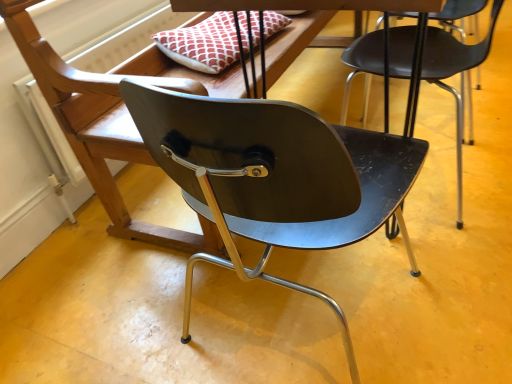
In order to face matte black chair at center, the 1th chair viewed from the left, should I rotate leftwards or rightwards?

Rotate right and turn 4.999 degrees.

The width and height of the screenshot is (512, 384). I want to click on matte black chair at center, which is the second chair in right-to-left order, so click(97, 132).

The height and width of the screenshot is (384, 512). What do you see at coordinates (97, 132) in the screenshot?
I see `matte black chair at center, the 1th chair viewed from the left` at bounding box center [97, 132].

What do you see at coordinates (454, 74) in the screenshot? I see `matte black chair at center, which ranks as the first chair in right-to-left order` at bounding box center [454, 74].

Where is `matte black chair at center, acting as the second chair starting from the left`? The height and width of the screenshot is (384, 512). matte black chair at center, acting as the second chair starting from the left is located at coordinates pyautogui.click(x=454, y=74).

What is the approximate height of matte black chair at center, acting as the second chair starting from the left?

It is 24.71 inches.

Find the location of a particular element. matte black chair at center, which is the second chair in right-to-left order is located at coordinates click(x=97, y=132).

Which object is positioned more to the right, matte black chair at center, which is the second chair in right-to-left order, or matte black chair at center, acting as the second chair starting from the left?

matte black chair at center, acting as the second chair starting from the left.

Does matte black chair at center, the 1th chair viewed from the left, lie behind matte black chair at center, acting as the second chair starting from the left?

That is False.

Is point (77, 154) in front of point (350, 79)?

Yes.

From the image's perspective, is matte black chair at center, the 1th chair viewed from the left, above matte black chair at center, which ranks as the first chair in right-to-left order?

No.

From a real-world perspective, is matte black chair at center, which is the second chair in right-to-left order, over matte black chair at center, acting as the second chair starting from the left?

Indeed, from a real-world perspective, matte black chair at center, which is the second chair in right-to-left order, stands above matte black chair at center, acting as the second chair starting from the left.

Which of these two, matte black chair at center, which is the second chair in right-to-left order, or matte black chair at center, acting as the second chair starting from the left, is thinner?

matte black chair at center, acting as the second chair starting from the left.

Can you confirm if matte black chair at center, the 1th chair viewed from the left, is taller than matte black chair at center, acting as the second chair starting from the left?

Yes, matte black chair at center, the 1th chair viewed from the left, is taller than matte black chair at center, acting as the second chair starting from the left.

Consider the image. Considering the relative sizes of matte black chair at center, which is the second chair in right-to-left order, and matte black chair at center, which ranks as the first chair in right-to-left order, in the image provided, is matte black chair at center, which is the second chair in right-to-left order, bigger than matte black chair at center, which ranks as the first chair in right-to-left order,?

Yes.

Which is correct: matte black chair at center, which is the second chair in right-to-left order, is inside matte black chair at center, which ranks as the first chair in right-to-left order, or outside of it?

matte black chair at center, which is the second chair in right-to-left order, lies outside matte black chair at center, which ranks as the first chair in right-to-left order.

Are matte black chair at center, which is the second chair in right-to-left order, and matte black chair at center, which ranks as the first chair in right-to-left order, located far from each other?

No, matte black chair at center, which is the second chair in right-to-left order, is not far away from matte black chair at center, which ranks as the first chair in right-to-left order.

Is matte black chair at center, the 1th chair viewed from the left, oriented towards matte black chair at center, acting as the second chair starting from the left?

Yes.

In order to click on chair below the matte black chair at center, the 1th chair viewed from the left (from a real-world perspective) in this screenshot , I will do `click(454, 74)`.

Does matte black chair at center, acting as the second chair starting from the left, appear on the left side of matte black chair at center, which is the second chair in right-to-left order?

No, matte black chair at center, acting as the second chair starting from the left, is not to the left of matte black chair at center, which is the second chair in right-to-left order.

Does matte black chair at center, acting as the second chair starting from the left, lie behind matte black chair at center, which is the second chair in right-to-left order?

Yes, matte black chair at center, acting as the second chair starting from the left, is further from the viewer.

Does point (458, 225) appear closer or farther from the camera than point (66, 100)?

Point (458, 225) appears to be farther away from the viewer than point (66, 100).

From the image's perspective, which is above, matte black chair at center, acting as the second chair starting from the left, or matte black chair at center, which is the second chair in right-to-left order?

matte black chair at center, acting as the second chair starting from the left, appears higher in the image.

From a real-world perspective, is matte black chair at center, which ranks as the first chair in right-to-left order, on matte black chair at center, which is the second chair in right-to-left order?

No, from a real-world perspective, matte black chair at center, which ranks as the first chair in right-to-left order, is not over matte black chair at center, which is the second chair in right-to-left order

Considering the sizes of objects matte black chair at center, which ranks as the first chair in right-to-left order, and matte black chair at center, the 1th chair viewed from the left, in the image provided, who is thinner, matte black chair at center, which ranks as the first chair in right-to-left order, or matte black chair at center, the 1th chair viewed from the left,?

matte black chair at center, which ranks as the first chair in right-to-left order.

Is matte black chair at center, which ranks as the first chair in right-to-left order, taller than matte black chair at center, which is the second chair in right-to-left order?

In fact, matte black chair at center, which ranks as the first chair in right-to-left order, may be shorter than matte black chair at center, which is the second chair in right-to-left order.

Looking at the image, does matte black chair at center, which ranks as the first chair in right-to-left order, seem bigger or smaller compared to matte black chair at center, which is the second chair in right-to-left order?

Clearly, matte black chair at center, which ranks as the first chair in right-to-left order, is smaller in size than matte black chair at center, which is the second chair in right-to-left order.

Is matte black chair at center, acting as the second chair starting from the left, situated inside matte black chair at center, the 1th chair viewed from the left, or outside?

matte black chair at center, acting as the second chair starting from the left, cannot be found inside matte black chair at center, the 1th chair viewed from the left.

Is matte black chair at center, which ranks as the first chair in right-to-left order, positioned far away from matte black chair at center, which is the second chair in right-to-left order?

No, there isn't a large distance between matte black chair at center, which ranks as the first chair in right-to-left order, and matte black chair at center, which is the second chair in right-to-left order.

Is matte black chair at center, acting as the second chair starting from the left, oriented towards matte black chair at center, the 1th chair viewed from the left?

No, matte black chair at center, acting as the second chair starting from the left, is not oriented towards matte black chair at center, the 1th chair viewed from the left.

How different are the orientations of matte black chair at center, acting as the second chair starting from the left, and matte black chair at center, the 1th chair viewed from the left, in degrees?

90 degrees separate the facing orientations of matte black chair at center, acting as the second chair starting from the left, and matte black chair at center, the 1th chair viewed from the left.

This screenshot has height=384, width=512. Identify the location of chair in front of the matte black chair at center, acting as the second chair starting from the left. (97, 132).

Where is `chair below the matte black chair at center, the 1th chair viewed from the left (from a real-world perspective)`? chair below the matte black chair at center, the 1th chair viewed from the left (from a real-world perspective) is located at coordinates (454, 74).

The image size is (512, 384). I want to click on chair behind the matte black chair at center, which is the second chair in right-to-left order, so click(454, 74).